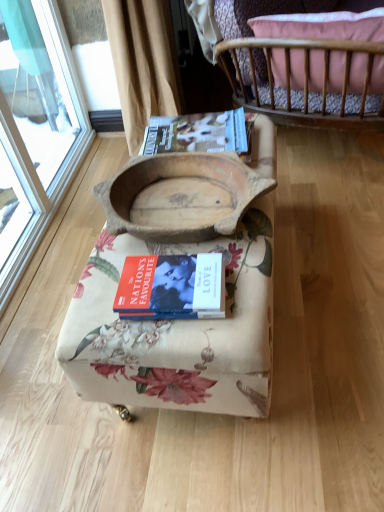
Question: From a real-world perspective, is hardcover magazine at upper center beneath hardcover book at center?

Choices:
 (A) no
 (B) yes

Answer: (A)

Question: Does hardcover magazine at upper center have a lesser width compared to hardcover book at center?

Choices:
 (A) no
 (B) yes

Answer: (A)

Question: Is hardcover magazine at upper center positioned behind hardcover book at center?

Choices:
 (A) yes
 (B) no

Answer: (A)

Question: Could you tell me if hardcover magazine at upper center is facing hardcover book at center?

Choices:
 (A) no
 (B) yes

Answer: (A)

Question: Does hardcover magazine at upper center have a greater width compared to hardcover book at center?

Choices:
 (A) yes
 (B) no

Answer: (A)

Question: Based on their sizes in the image, would you say wooden bowl at center, acting as the 1th furniture starting from the bottom, is bigger or smaller than hardcover book at center?

Choices:
 (A) big
 (B) small

Answer: (A)

Question: From a real-world perspective, is wooden bowl at center, arranged as the 2th furniture when viewed from the top, above or below hardcover book at center?

Choices:
 (A) above
 (B) below

Answer: (B)

Question: Which is correct: wooden bowl at center, acting as the 1th furniture starting from the bottom, is inside hardcover book at center, or outside of it?

Choices:
 (A) inside
 (B) outside

Answer: (B)

Question: From the image's perspective, is wooden bowl at center, acting as the 1th furniture starting from the bottom, above or below hardcover book at center?

Choices:
 (A) above
 (B) below

Answer: (A)

Question: Considering their positions, is hardcover book at center located in front of or behind wooden bowl at center, arranged as the 2th furniture when viewed from the top?

Choices:
 (A) front
 (B) behind

Answer: (B)

Question: From a real-world perspective, is hardcover book at center positioned above or below wooden bowl at center, acting as the 1th furniture starting from the bottom?

Choices:
 (A) below
 (B) above

Answer: (B)

Question: Considering the positions of hardcover book at center and wooden bowl at center, acting as the 1th furniture starting from the bottom, in the image, is hardcover book at center taller or shorter than wooden bowl at center, acting as the 1th furniture starting from the bottom,?

Choices:
 (A) short
 (B) tall

Answer: (A)

Question: Considering the positions of hardcover book at center and wooden bowl at center, arranged as the 2th furniture when viewed from the top, in the image, is hardcover book at center bigger or smaller than wooden bowl at center, arranged as the 2th furniture when viewed from the top,?

Choices:
 (A) small
 (B) big

Answer: (A)

Question: Relative to hardcover book at center, is wooden crib at upper right, which is the 1th furniture from top to bottom, in front or behind?

Choices:
 (A) front
 (B) behind

Answer: (B)

Question: Considering the positions of point (256, 55) and point (210, 268), is point (256, 55) closer or farther from the camera than point (210, 268)?

Choices:
 (A) closer
 (B) farther

Answer: (B)